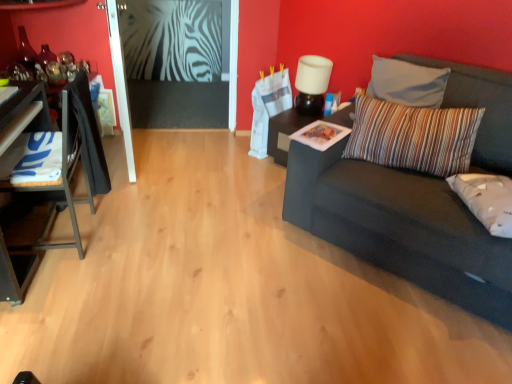
Question: Is white matte lamp at upper center positioned with its back to black glossy table at center, which is the second table in front-to-back order?

Choices:
 (A) yes
 (B) no

Answer: (B)

Question: From the image's perspective, does white matte lamp at upper center appear lower than black glossy table at center, which is the 1th table in back-to-front order?

Choices:
 (A) no
 (B) yes

Answer: (A)

Question: Is white matte lamp at upper center smaller than black glossy table at center, which is the second table in front-to-back order?

Choices:
 (A) yes
 (B) no

Answer: (A)

Question: Is white matte lamp at upper center oriented towards black glossy table at center, which is the first table from right to left?

Choices:
 (A) yes
 (B) no

Answer: (B)

Question: Considering the relative sizes of white matte lamp at upper center and black glossy table at center, which is the second table in front-to-back order, in the image provided, is white matte lamp at upper center taller than black glossy table at center, which is the second table in front-to-back order,?

Choices:
 (A) yes
 (B) no

Answer: (A)

Question: From the image's perspective, is white matte lamp at upper center on top of black glossy table at center, which is the first table from right to left?

Choices:
 (A) no
 (B) yes

Answer: (B)

Question: Would you say white matte lamp at upper center contains dark gray fabric couch at right?

Choices:
 (A) no
 (B) yes

Answer: (A)

Question: From a real-world perspective, is white matte lamp at upper center physically above dark gray fabric couch at right?

Choices:
 (A) yes
 (B) no

Answer: (A)

Question: Is white matte lamp at upper center completely or partially outside of dark gray fabric couch at right?

Choices:
 (A) yes
 (B) no

Answer: (A)

Question: Could you tell me if white matte lamp at upper center is facing dark gray fabric couch at right?

Choices:
 (A) no
 (B) yes

Answer: (A)

Question: Does white matte lamp at upper center have a lesser height compared to dark gray fabric couch at right?

Choices:
 (A) no
 (B) yes

Answer: (B)

Question: Does white matte lamp at upper center have a larger size compared to dark gray fabric couch at right?

Choices:
 (A) yes
 (B) no

Answer: (B)

Question: From the image's perspective, is white fabric pillow at right, acting as the 2th pillow starting from the top, located above striped fabric pillow at right, arranged as the second pillow when ordered from the bottom?

Choices:
 (A) no
 (B) yes

Answer: (A)